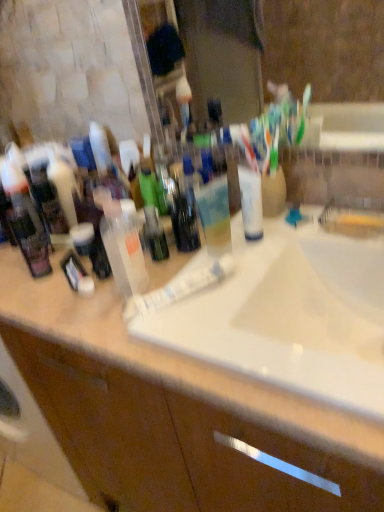
Locate an element on the screen. The height and width of the screenshot is (512, 384). vacant space situated above white glossy sink at center (from a real-world perspective) is located at coordinates (270, 260).